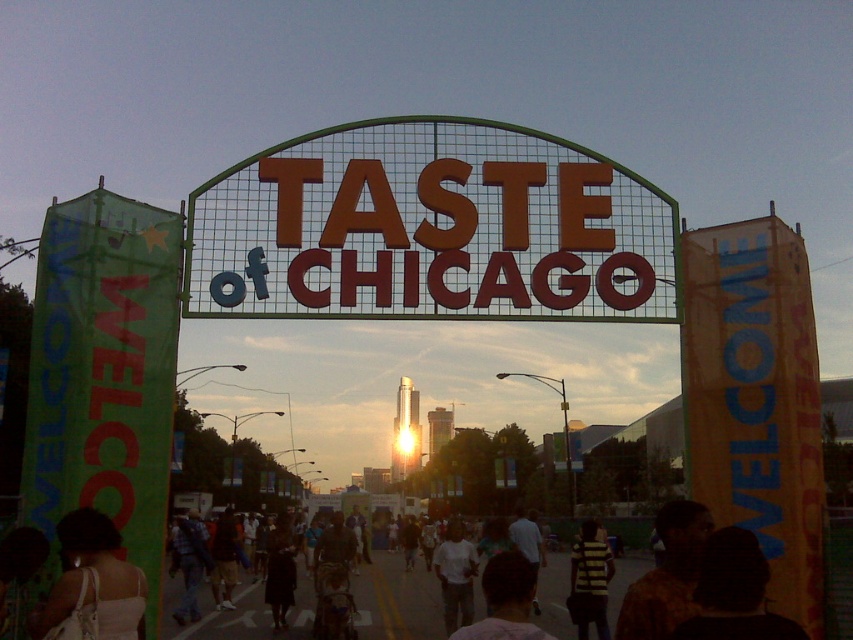
Question: Which point is farther to the camera?

Choices:
 (A) (491, 563)
 (B) (318, 296)
 (C) (56, 612)
 (D) (694, 600)

Answer: (A)

Question: Can you confirm if dark hair at center is positioned above white cotton shirt at center?

Choices:
 (A) no
 (B) yes

Answer: (B)

Question: Considering the real-world distances, which object is closest to the metallic gold sign at center?

Choices:
 (A) dark hair at center
 (B) white cotton shirt at center
 (C) white fabric bag at lower left
 (D) striped fabric shirt at center

Answer: (A)

Question: Is dark hair at center closer to the viewer compared to striped fabric shirt at center?

Choices:
 (A) no
 (B) yes

Answer: (B)

Question: Is dark hair at center closer to camera compared to white cotton shirt at center?

Choices:
 (A) yes
 (B) no

Answer: (A)

Question: Which of the following is the farthest from the observer?

Choices:
 (A) white fabric bag at lower left
 (B) white cotton shirt at center
 (C) dark hair at center

Answer: (B)